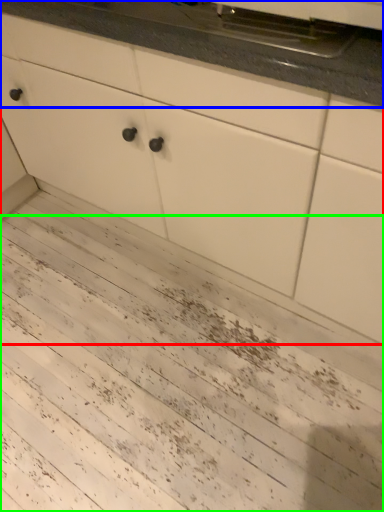
Question: Which object is positioned closest to cabinetry (highlighted by a red box)? Select from countertop (highlighted by a blue box) and mud (highlighted by a green box).

Choices:
 (A) countertop
 (B) mud

Answer: (A)